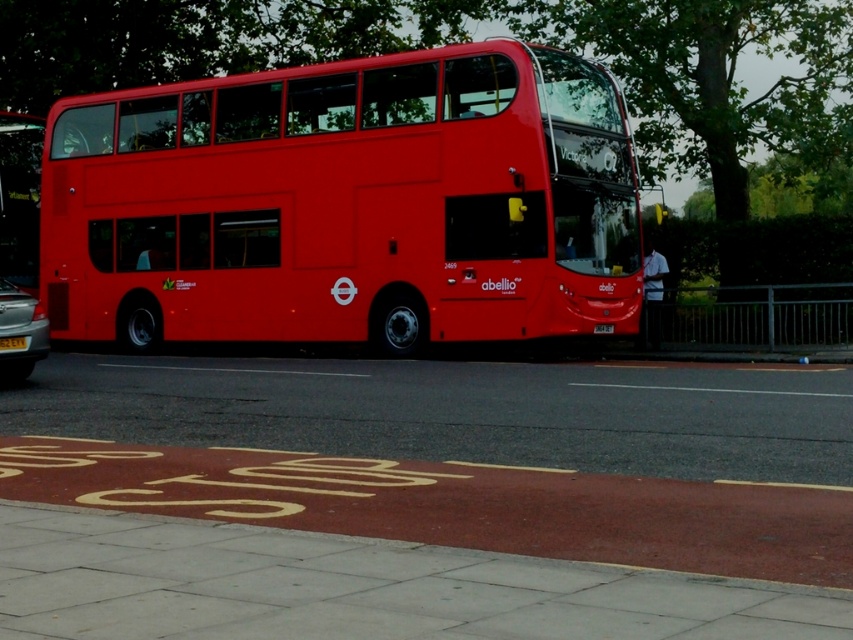
Question: Is shiny red bus at center further to camera compared to yellow matte license plate at center?

Choices:
 (A) yes
 (B) no

Answer: (A)

Question: Does shiny red bus at center appear over yellow matte license plate at center?

Choices:
 (A) yes
 (B) no

Answer: (A)

Question: Which object appears farthest from the camera in this image?

Choices:
 (A) metallic silver car at left
 (B) shiny red bus at center

Answer: (B)

Question: Which object appears closest to the camera in this image?

Choices:
 (A) metallic silver car at left
 (B) shiny red bus at center
 (C) yellow matte license plate at center

Answer: (C)

Question: Which point is farther to the camera?

Choices:
 (A) yellow matte license plate at center
 (B) shiny red bus at center

Answer: (B)

Question: Is metallic silver car at left further to the viewer compared to yellow matte license plate at center?

Choices:
 (A) no
 (B) yes

Answer: (B)